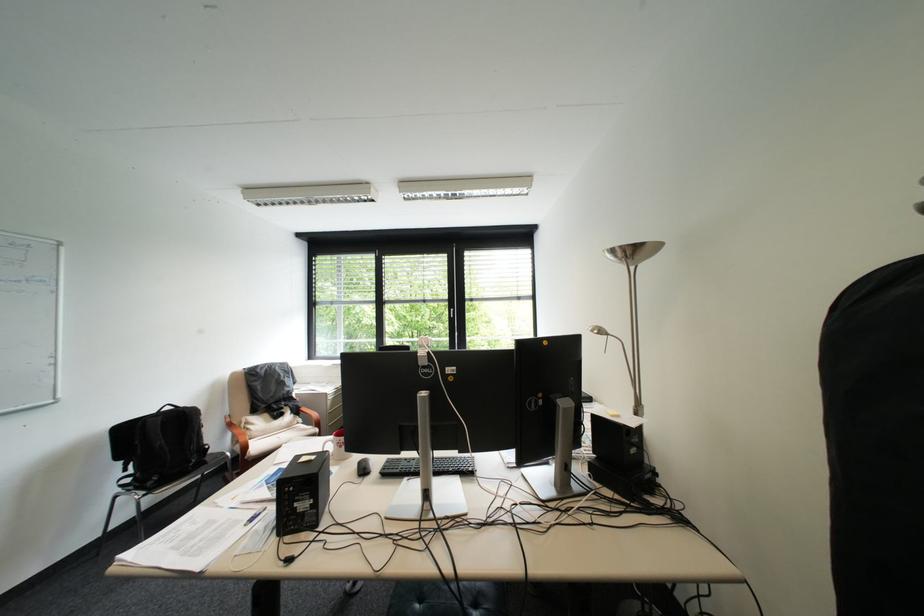
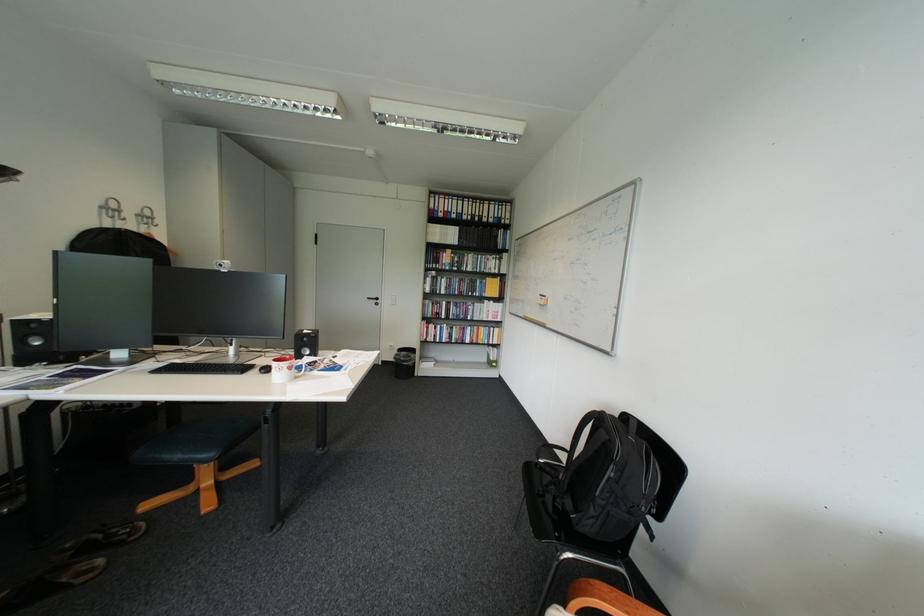
Where in the second image is the point corresponding to point 463,469 from the first image?

(205, 363)